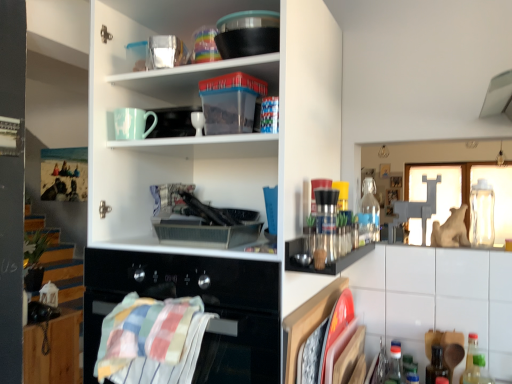
The height and width of the screenshot is (384, 512). I want to click on striped cotton towel at lower left, so click(x=151, y=340).

Locate an element on the screen. matte ceramic mug at upper center is located at coordinates (132, 123).

What is the approximate width of matte ceramic mug at upper center?

The width of matte ceramic mug at upper center is 3.02 inches.

What is the approximate height of clear glass bottle at upper right, the 5th bottle from the front?

clear glass bottle at upper right, the 5th bottle from the front, is 24.22 centimeters tall.

You are a GUI agent. You are given a task and a screenshot of the screen. Output one action in this format:
    pyautogui.click(x=<x>, y=<y>)
    Task: Click on the clear glass bottle at upper right, which is counted as the fifth bottle, starting from the right
    This screenshot has width=512, height=384.
    Given the screenshot: What is the action you would take?
    pyautogui.click(x=370, y=209)

Where is `blue plastic bottle at lower right, the third bottle when ordered from left to right`? The image size is (512, 384). blue plastic bottle at lower right, the third bottle when ordered from left to right is located at coordinates (409, 368).

Based on the photo, measure the distance between blue plastic bottle at lower right, the third bottle when ordered from left to right, and camera.

1.15 meters.

What do you see at coordinates (394, 366) in the screenshot? The image size is (512, 384). I see `transparent plastic bottle at lower right, which is the 2th bottle from left to right` at bounding box center [394, 366].

Measure the distance between point [152,275] and camera.

A distance of 3.63 feet exists between point [152,275] and camera.

What is the approximate width of black glass oven at center?

The width of black glass oven at center is 73.93 centimeters.

The image size is (512, 384). I want to click on striped cotton towel at lower left, so click(151, 340).

Looking at this image, is blue plastic bottle at lower right, arranged as the second bottle when viewed from the front, located outside clear glass bottle at upper right, the 5th bottle from the front?

Yes, blue plastic bottle at lower right, arranged as the second bottle when viewed from the front, is not within clear glass bottle at upper right, the 5th bottle from the front.

From a real-world perspective, is blue plastic bottle at lower right, which is counted as the 4th bottle, starting from the back, positioned under clear glass bottle at upper right, arranged as the 1th bottle when viewed from the back, based on gravity?

Yes, from a real-world perspective, blue plastic bottle at lower right, which is counted as the 4th bottle, starting from the back, is beneath clear glass bottle at upper right, arranged as the 1th bottle when viewed from the back.

Consider the image. Relative to clear glass bottle at upper right, the 5th bottle from the front, is blue plastic bottle at lower right, which is counted as the 4th bottle, starting from the back, in front or behind?

blue plastic bottle at lower right, which is counted as the 4th bottle, starting from the back, is in front of clear glass bottle at upper right, the 5th bottle from the front.

Is blue plastic bottle at lower right, the third bottle from the right, positioned with its back to clear glass bottle at upper right, the 5th bottle from the front?

No, blue plastic bottle at lower right, the third bottle from the right, is not facing the opposite direction of clear glass bottle at upper right, the 5th bottle from the front.

How different are the orientations of transparent plastic bottle at lower right, arranged as the 3th bottle when viewed from the back, and striped cotton towel at lower left in degrees?

The angular difference between transparent plastic bottle at lower right, arranged as the 3th bottle when viewed from the back, and striped cotton towel at lower left is 91.8 degrees.

Where is `material on the left of transparent plastic bottle at lower right, which is counted as the third bottle, starting from the front`? material on the left of transparent plastic bottle at lower right, which is counted as the third bottle, starting from the front is located at coordinates (151, 340).

Can you confirm if transparent plastic bottle at lower right, which is counted as the third bottle, starting from the front, is shorter than striped cotton towel at lower left?

In fact, transparent plastic bottle at lower right, which is counted as the third bottle, starting from the front, may be taller than striped cotton towel at lower left.

From the image's perspective, is transparent plastic bottle at lower right, arranged as the 3th bottle when viewed from the back, on striped cotton towel at lower left?

Incorrect, from the image's perspective, transparent plastic bottle at lower right, arranged as the 3th bottle when viewed from the back, is lower than striped cotton towel at lower left.

From a real-world perspective, is blue plastic bottle at lower right, the third bottle from the right, beneath white matte cupboard at upper left?

Correct, in the physical world, blue plastic bottle at lower right, the third bottle from the right, is lower than white matte cupboard at upper left.

In the scene shown: Looking at the image, does blue plastic bottle at lower right, the third bottle from the right, seem bigger or smaller compared to white matte cupboard at upper left?

Clearly, blue plastic bottle at lower right, the third bottle from the right, is smaller in size than white matte cupboard at upper left.

Is blue plastic bottle at lower right, arranged as the second bottle when viewed from the front, taller or shorter than white matte cupboard at upper left?

blue plastic bottle at lower right, arranged as the second bottle when viewed from the front, is shorter than white matte cupboard at upper left.

Which object is thinner, transparent plastic bottle at lower right, which is the 2th bottle from left to right, or clear glass bottle at upper right, positioned as the fifth bottle in left-to-right order?

Thinner between the two is transparent plastic bottle at lower right, which is the 2th bottle from left to right.

From a real-world perspective, count 3rd bottles upward from the transparent plastic bottle at lower right, placed as the 4th bottle when sorted from right to left, and point to it. Please provide its 2D coordinates.

[(482, 214)]

Considering the relative positions of transparent plastic bottle at lower right, which is counted as the third bottle, starting from the front, and clear glass bottle at upper right, positioned as the fifth bottle in left-to-right order, in the image provided, is transparent plastic bottle at lower right, which is counted as the third bottle, starting from the front, to the right of clear glass bottle at upper right, positioned as the fifth bottle in left-to-right order, from the viewer's perspective?

In fact, transparent plastic bottle at lower right, which is counted as the third bottle, starting from the front, is to the left of clear glass bottle at upper right, positioned as the fifth bottle in left-to-right order.

Is transparent plastic bottle at lower right, which is the 2th bottle from left to right, looking in the opposite direction of clear glass bottle at upper right, arranged as the second bottle when viewed from the back?

transparent plastic bottle at lower right, which is the 2th bottle from left to right, does not have its back to clear glass bottle at upper right, arranged as the second bottle when viewed from the back.

In the scene shown: Considering the sizes of objects black glass oven at center and wooden cabinet at lower left, the 1th cabinetry in the bottom-to-top sequence, in the image provided, who is thinner, black glass oven at center or wooden cabinet at lower left, the 1th cabinetry in the bottom-to-top sequence,?

With smaller width is wooden cabinet at lower left, the 1th cabinetry in the bottom-to-top sequence.

Is the surface of black glass oven at center in direct contact with wooden cabinet at lower left, acting as the second cabinetry starting from the top?

No, black glass oven at center is not next to wooden cabinet at lower left, acting as the second cabinetry starting from the top.

Does black glass oven at center have a larger size compared to wooden cabinet at lower left, the 1th cabinetry in the bottom-to-top sequence?

Correct, black glass oven at center is larger in size than wooden cabinet at lower left, the 1th cabinetry in the bottom-to-top sequence.

Between point (234, 344) and point (57, 327), which one is positioned in front?

The point (234, 344) is closer.

Which object is positioned more to the left, clear glass bottle at upper right, the 5th bottle from the front, or clear glass bottle at upper right, arranged as the second bottle when viewed from the back?

clear glass bottle at upper right, the 5th bottle from the front, is more to the left.

From the image's perspective, between clear glass bottle at upper right, the 5th bottle from the front, and clear glass bottle at upper right, the 1th bottle when ordered from right to left, which one is located above?

clear glass bottle at upper right, the 5th bottle from the front, is shown above in the image.

Is clear glass bottle at upper right, the 5th bottle from the front, inside the boundaries of clear glass bottle at upper right, the 1th bottle when ordered from right to left, or outside?

clear glass bottle at upper right, the 5th bottle from the front, is located beyond the bounds of clear glass bottle at upper right, the 1th bottle when ordered from right to left.

In the scene shown: Is clear glass bottle at upper right, the 5th bottle from the front, facing away from clear glass bottle at upper right, positioned as the 4th bottle in front-to-back order?

No.

Is matte ceramic mug at upper center next to black glass oven at center and touching it?

There is a gap between matte ceramic mug at upper center and black glass oven at center.

Considering the relative sizes of matte ceramic mug at upper center and black glass oven at center in the image provided, is matte ceramic mug at upper center bigger than black glass oven at center?

Incorrect, matte ceramic mug at upper center is not larger than black glass oven at center.

At what (x,y) coordinates should I click in order to perform the action: click on bottle that is the 3rd one when counting downward from the clear glass bottle at upper right, which is counted as the fifth bottle, starting from the right (from the image's perspective). Please return your answer as a coordinate pair (x, y). Image resolution: width=512 pixels, height=384 pixels. Looking at the image, I should click on (409, 368).

Starting from the striped cotton towel at lower left, which bottle is the 2nd one to the right? Please provide its 2D coordinates.

[(394, 366)]

Based on their spatial positions, is white matte cupboard at upper left or black glass oven at center further from matte ceramic mug at upper center?

black glass oven at center lies further to matte ceramic mug at upper center than the other object.

From the image, which object appears to be farther from matte ceramic mug at upper center, clear glass bottle at upper right, arranged as the 1th bottle when viewed from the back, or transparent plastic bottle at lower right, which is counted as the third bottle, starting from the front?

transparent plastic bottle at lower right, which is counted as the third bottle, starting from the front, lies further to matte ceramic mug at upper center than the other object.

Looking at the image, which one is located further to striped cotton towel at lower left, transparent plastic bottle at lower right, placed as the 4th bottle when sorted from right to left, or green glass bottle at right, arranged as the 2th bottle when viewed from the right?

The object further to striped cotton towel at lower left is green glass bottle at right, arranged as the 2th bottle when viewed from the right.

Considering their positions, is clear glass bottle at upper right, arranged as the second bottle when viewed from the back, positioned closer to white matte cupboard at upper left than wooden cabinet at lower left, the 2th cabinetry in the front-to-back sequence?

clear glass bottle at upper right, arranged as the second bottle when viewed from the back, is positioned closer to the anchor white matte cupboard at upper left.

Looking at this image, which object lies further to the anchor point clear glass bottle at upper right, the 5th bottle from the front, wooden cabinet at lower left, the 2th cabinetry from the right, or striped cotton towel at lower left?

Among the two, wooden cabinet at lower left, the 2th cabinetry from the right, is located further to clear glass bottle at upper right, the 5th bottle from the front.

Estimate the real-world distances between objects in this image. Which object is closer to white matte cupboard at upper left, green glass bottle at right, which is counted as the fifth bottle, starting from the back, or wooden cabinet at lower left, acting as the second cabinetry starting from the top?

green glass bottle at right, which is counted as the fifth bottle, starting from the back, is closer to white matte cupboard at upper left.

Considering their positions, is white glossy cabinet at lower right, the 2th cabinetry in the left-to-right sequence, positioned further to clear glass bottle at upper right, positioned as the 4th bottle in front-to-back order, than transparent plastic bottle at lower right, placed as the 4th bottle when sorted from right to left?

Based on the image, transparent plastic bottle at lower right, placed as the 4th bottle when sorted from right to left, appears to be further to clear glass bottle at upper right, positioned as the 4th bottle in front-to-back order.

Looking at the image, which one is located further to black glass oven at center, white glossy cabinet at lower right, the 2th cabinetry in the left-to-right sequence, or green glass bottle at right, arranged as the 2th bottle when viewed from the right?

Among the two, green glass bottle at right, arranged as the 2th bottle when viewed from the right, is located further to black glass oven at center.

The width and height of the screenshot is (512, 384). Identify the location of cupboard between matte ceramic mug at upper center and blue plastic bottle at lower right, which is counted as the 4th bottle, starting from the back, in the horizontal direction. (210, 175).

The image size is (512, 384). Identify the location of cabinetry between clear glass bottle at upper right, the 5th bottle from the front, and green glass bottle at right, which is counted as the fifth bottle, starting from the back, vertically. (435, 299).

I want to click on oven between striped cotton towel at lower left and wooden cabinet at lower left, the 2th cabinetry from the right, along the z-axis, so click(204, 305).

The width and height of the screenshot is (512, 384). I want to click on cupboard between matte ceramic mug at upper center and striped cotton towel at lower left in the up-down direction, so click(210, 175).